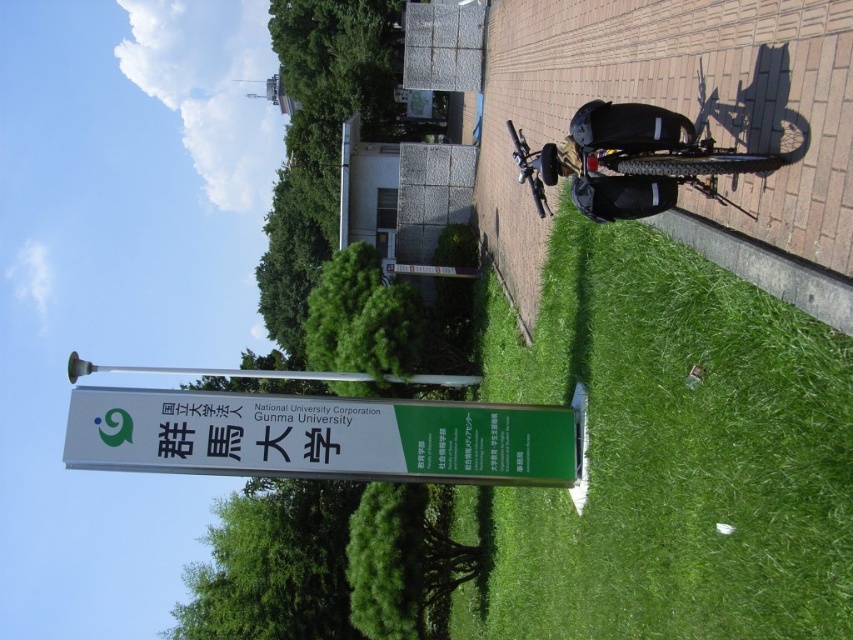
Question: Considering the real-world distances, which object is closest to the silver metallic pole at upper center?

Choices:
 (A) green plastic sign at center
 (B) green grass at lower center

Answer: (A)

Question: Which is farther from the green grass at lower center?

Choices:
 (A) green plastic sign at center
 (B) silver metallic pole at upper center

Answer: (B)

Question: Is green grass at lower center thinner than silver metallic pole at upper center?

Choices:
 (A) yes
 (B) no

Answer: (A)

Question: Is green grass at lower center to the left of silver metallic pole at upper center from the viewer's perspective?

Choices:
 (A) yes
 (B) no

Answer: (B)

Question: Does green grass at lower center have a larger size compared to green plastic sign at center?

Choices:
 (A) yes
 (B) no

Answer: (A)

Question: Which object appears farthest from the camera in this image?

Choices:
 (A) green plastic sign at center
 (B) green grass at lower center
 (C) silver metallic pole at upper center

Answer: (C)